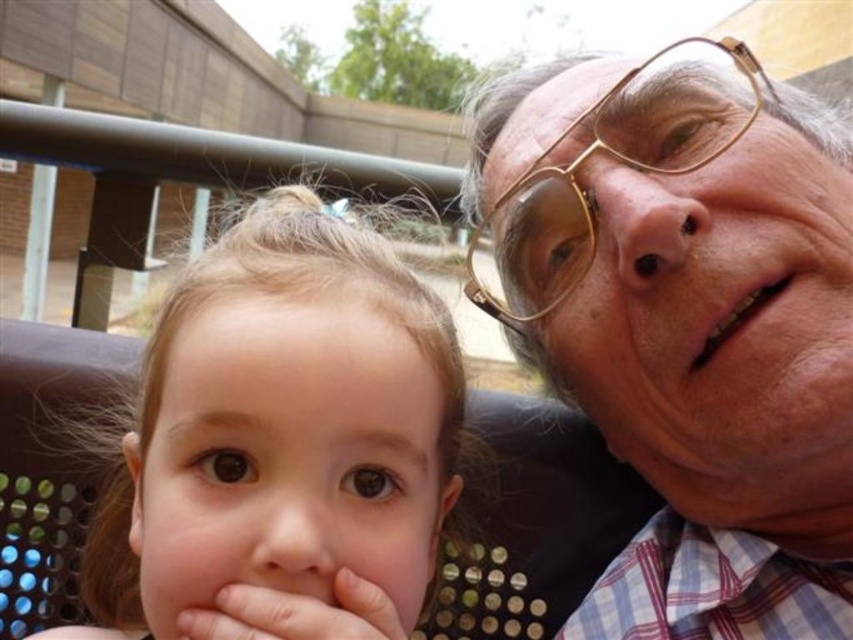
Who is positioned more to the right, gold metallic glasses at upper right or pink flesh hand at lower left?

From the viewer's perspective, gold metallic glasses at upper right appears more on the right side.

Does point (506, 298) come closer to viewer compared to point (212, 611)?

No, (506, 298) is behind (212, 611).

Where is `gold metallic glasses at upper right`? The width and height of the screenshot is (853, 640). gold metallic glasses at upper right is located at coordinates (618, 161).

Between matte gold glasses at upper right and pink flesh hand at lower left, which one has more height?

Standing taller between the two is matte gold glasses at upper right.

In order to click on matte gold glasses at upper right in this screenshot , I will do `click(686, 323)`.

Locate an element on the screen. The image size is (853, 640). matte gold glasses at upper right is located at coordinates (686, 323).

What do you see at coordinates (281, 428) in the screenshot?
I see `smooth skin baby at center` at bounding box center [281, 428].

Does smooth skin baby at center have a lesser height compared to pink flesh hand at lower left?

No.

Image resolution: width=853 pixels, height=640 pixels. I want to click on smooth skin baby at center, so click(281, 428).